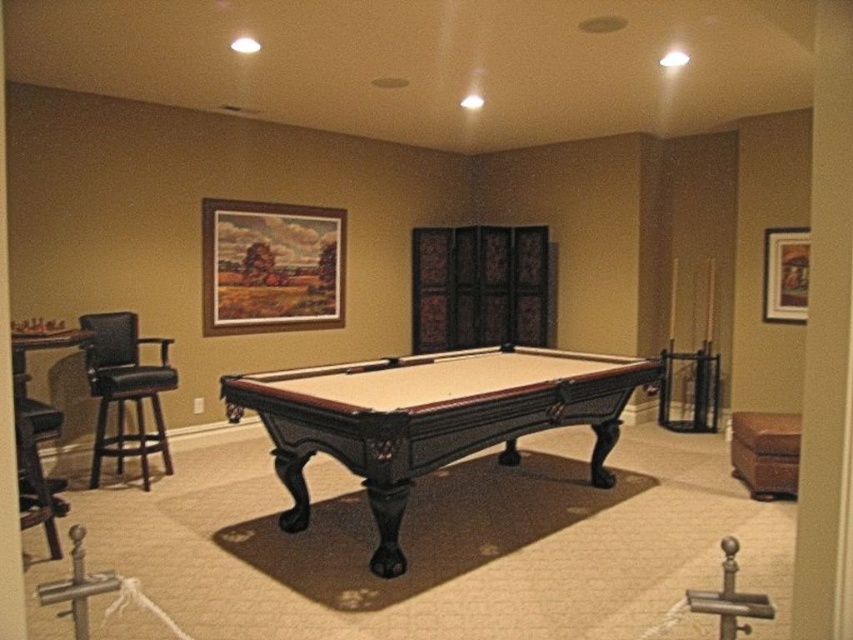
Question: Does wooden framed painting at upper center appear under wooden picture frame at upper right?

Choices:
 (A) yes
 (B) no

Answer: (B)

Question: Which of the following is the farthest from the observer?

Choices:
 (A) (229, 237)
 (B) (160, 403)
 (C) (773, 310)
 (D) (790, 428)

Answer: (A)

Question: Can you confirm if wooden framed painting at upper center is positioned to the right of black leather armchair at left?

Choices:
 (A) no
 (B) yes

Answer: (B)

Question: Can you confirm if black leather armchair at left is positioned below brown leather ottoman at lower right?

Choices:
 (A) yes
 (B) no

Answer: (B)

Question: Which of the following is the farthest from the observer?

Choices:
 (A) (352, 442)
 (B) (790, 429)
 (C) (132, 346)
 (D) (778, 285)

Answer: (D)

Question: Which point is closer to the camera?

Choices:
 (A) wooden picture frame at upper right
 (B) brown leather ottoman at lower right

Answer: (B)